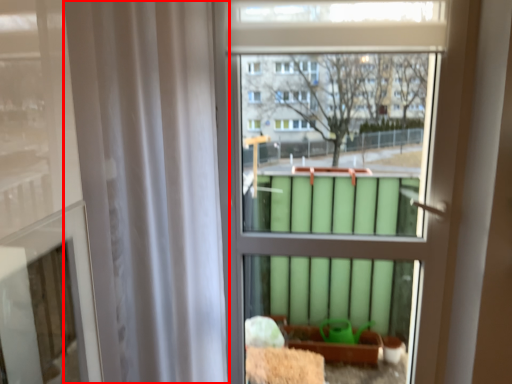
Question: From the image's perspective, what is the correct spatial relationship of shower curtain (annotated by the red box) in relation to bay window?

Choices:
 (A) above
 (B) below

Answer: (B)